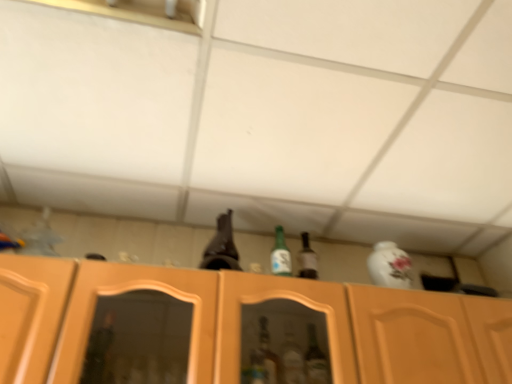
Question: Can you confirm if wooden cabinet at center is taller than green glass bottle at center?

Choices:
 (A) no
 (B) yes

Answer: (B)

Question: Is wooden cabinet at center directly adjacent to green glass bottle at center?

Choices:
 (A) no
 (B) yes

Answer: (A)

Question: Is wooden cabinet at center surrounding green glass bottle at center?

Choices:
 (A) yes
 (B) no

Answer: (B)

Question: From the image's perspective, is wooden cabinet at center below green glass bottle at center?

Choices:
 (A) no
 (B) yes

Answer: (B)

Question: Is there a large distance between wooden cabinet at center and green glass bottle at center?

Choices:
 (A) no
 (B) yes

Answer: (A)

Question: Considering the relative positions of wooden cabinet at center and green glass bottle at center in the image provided, is wooden cabinet at center to the left of green glass bottle at center from the viewer's perspective?

Choices:
 (A) yes
 (B) no

Answer: (B)

Question: Is green glass bottle at center not near wooden cabinet at center?

Choices:
 (A) no
 (B) yes

Answer: (A)

Question: Does green glass bottle at center have a greater height compared to wooden cabinet at center?

Choices:
 (A) no
 (B) yes

Answer: (A)

Question: Considering the relative sizes of green glass bottle at center and wooden cabinet at center in the image provided, is green glass bottle at center shorter than wooden cabinet at center?

Choices:
 (A) yes
 (B) no

Answer: (A)

Question: Is green glass bottle at center facing away from wooden cabinet at center?

Choices:
 (A) no
 (B) yes

Answer: (A)

Question: Is green glass bottle at center oriented towards wooden cabinet at center?

Choices:
 (A) no
 (B) yes

Answer: (A)

Question: Is green glass bottle at center with wooden cabinet at center?

Choices:
 (A) no
 (B) yes

Answer: (A)

Question: Is green glass bottle at center bigger than brown glass beer bottle at upper center?

Choices:
 (A) no
 (B) yes

Answer: (A)